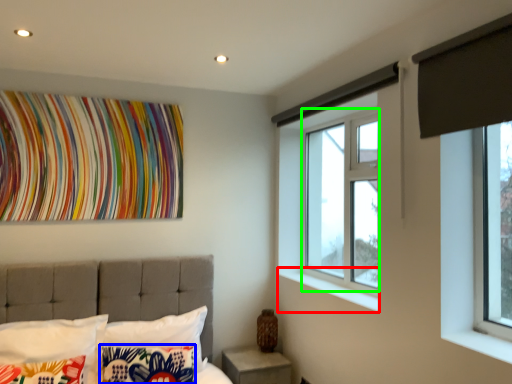
Question: Considering the real-world distances, which object is closest to window sill (highlighted by a red box)? pillow (highlighted by a blue box) or bay window (highlighted by a green box).

Choices:
 (A) pillow
 (B) bay window

Answer: (B)